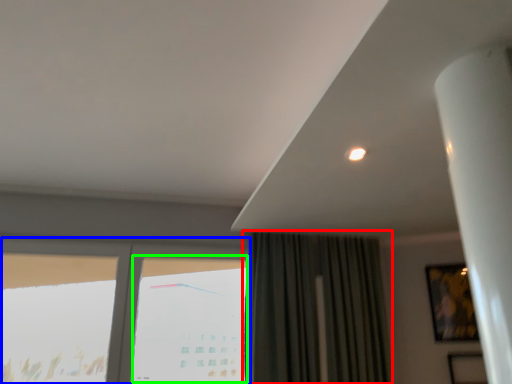
Question: Estimate the real-world distances between objects in this image. Which object is closer to curtain (highlighted by a red box), window (highlighted by a blue box) or window (highlighted by a green box)?

Choices:
 (A) window
 (B) window

Answer: (B)